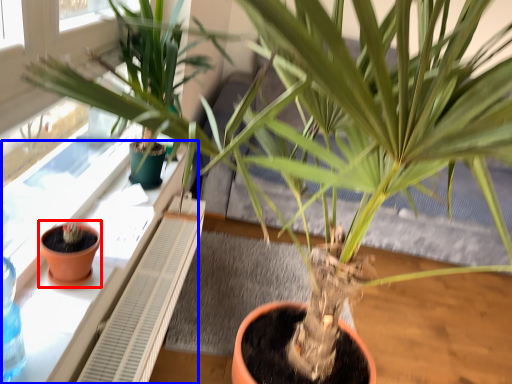
Question: Among these objects, which one is nearest to the camera, flowerpot (highlighted by a red box) or window sill (highlighted by a blue box)?

Choices:
 (A) flowerpot
 (B) window sill

Answer: (B)